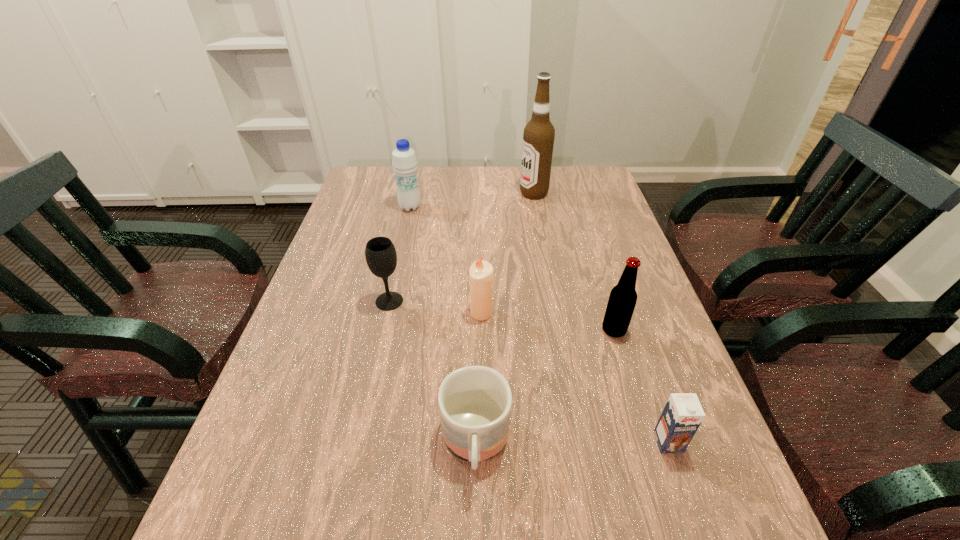
The width and height of the screenshot is (960, 540). In order to click on free spot located 0.110m on the label of the tallest object in this screenshot , I will do 487,193.

The image size is (960, 540). Identify the location of free space located 0.090m on the left of the water bottle. (370, 207).

Locate an element on the screen. This screenshot has height=540, width=960. free space located 0.280m on the left of the beer bottle is located at coordinates tap(480, 330).

Find the location of a particular element. vacant space situated 0.230m on the front of the wineglass is located at coordinates (369, 393).

You are a GUI agent. You are given a task and a screenshot of the screen. Output one action in this format:
    pyautogui.click(x=<x>, y=<y>)
    Task: Click on the vacant space situated 0.260m on the back of the candle
    The image size is (960, 540).
    Given the screenshot: What is the action you would take?
    pyautogui.click(x=481, y=242)

Locate an element on the screen. The image size is (960, 540). free space located 0.140m on the front label of the chocolate milk is located at coordinates (702, 539).

I want to click on vacant region located 0.060m on the side with the handle of the mug, so click(x=474, y=532).

I want to click on alcohol that is at the far edge, so click(538, 138).

Where is `water bottle present at the far edge`? The height and width of the screenshot is (540, 960). water bottle present at the far edge is located at coordinates (404, 161).

You are a GUI agent. You are given a task and a screenshot of the screen. Output one action in this format:
    pyautogui.click(x=<x>, y=<y>)
    Task: Click on the beer bottle that is at the right edge
    This screenshot has width=960, height=540.
    Given the screenshot: What is the action you would take?
    pyautogui.click(x=622, y=300)